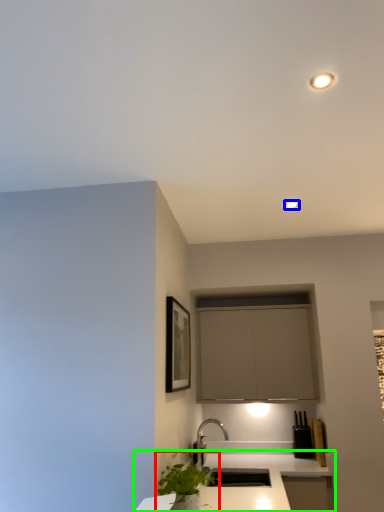
Question: Considering the real-world distances, which object is closest to houseplant (highlighted by a red box)? light fixture (highlighted by a blue box) or countertop (highlighted by a green box).

Choices:
 (A) light fixture
 (B) countertop

Answer: (B)